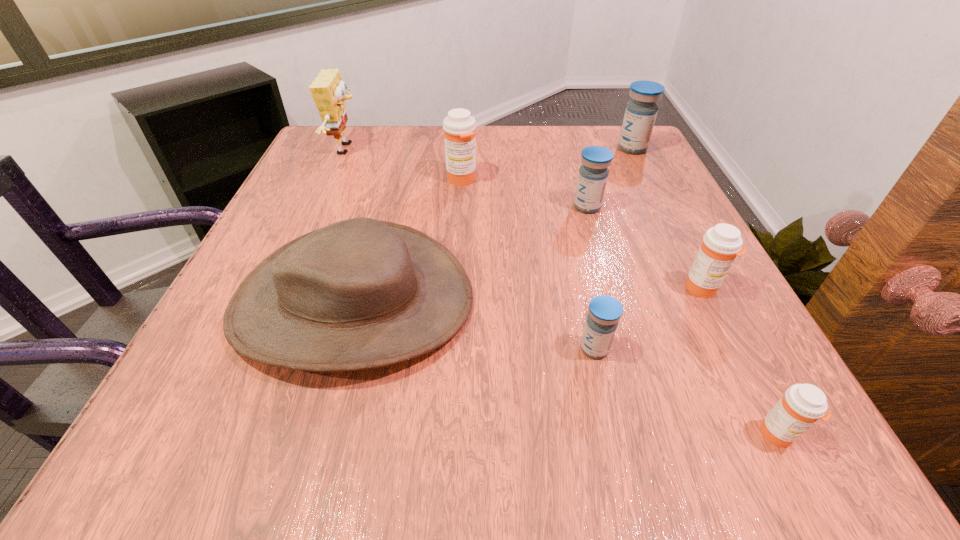
Identify the location of yellow sponge. This screenshot has height=540, width=960. (327, 90).

At what (x,y) coordinates should I click in order to perform the action: click on the rightmost blue medicine. Please return your answer as a coordinate pair (x, y). Looking at the image, I should click on (640, 114).

Where is `the farthest medicine`? The width and height of the screenshot is (960, 540). the farthest medicine is located at coordinates (640, 114).

The width and height of the screenshot is (960, 540). Find the location of `the farthest orange medicine`. the farthest orange medicine is located at coordinates (459, 126).

Identify the location of the leftmost medicine. (459, 126).

The width and height of the screenshot is (960, 540). Find the location of `the fourth nearest medicine`. the fourth nearest medicine is located at coordinates (593, 174).

Locate an element on the screen. the second farthest blue medicine is located at coordinates (593, 174).

Where is `the second smallest orange medicine`? the second smallest orange medicine is located at coordinates (721, 244).

Locate an element on the screen. The width and height of the screenshot is (960, 540). the fourth farthest medicine is located at coordinates (721, 244).

Locate an element on the screen. This screenshot has width=960, height=540. cowboy hat is located at coordinates (360, 293).